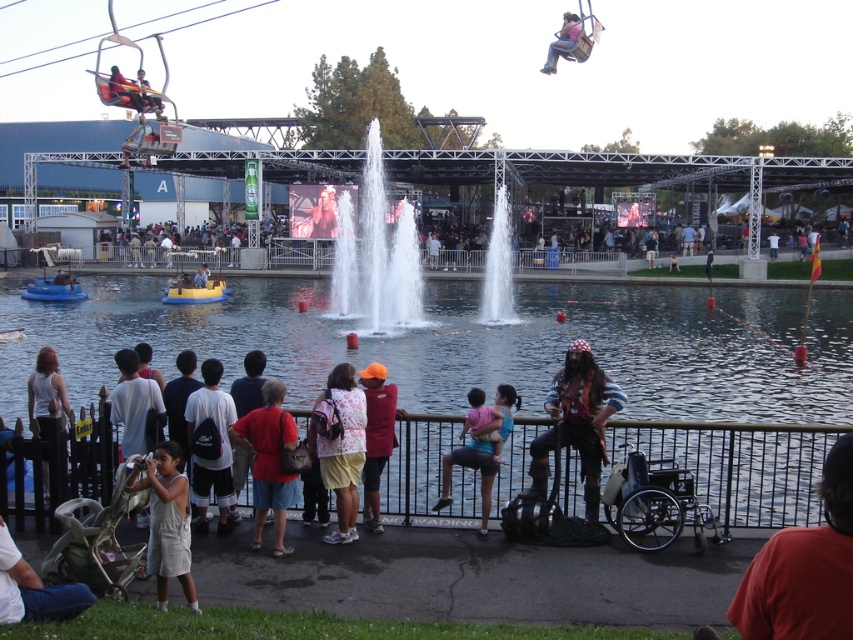
You are organizing a costume party and need to decide which costume to choose between the wooden pirate costume at lower right and the blue denim jeans at center. Which one is smaller in size?

→ The wooden pirate costume at lower right is smaller in size compared to the blue denim jeans at center.

You are a photographer standing at the fair and want to capture a photo of the clear water jets at center and the orange fabric vest at center. Which object is taller in the image?

The clear water jets at center is taller than the orange fabric vest at center.